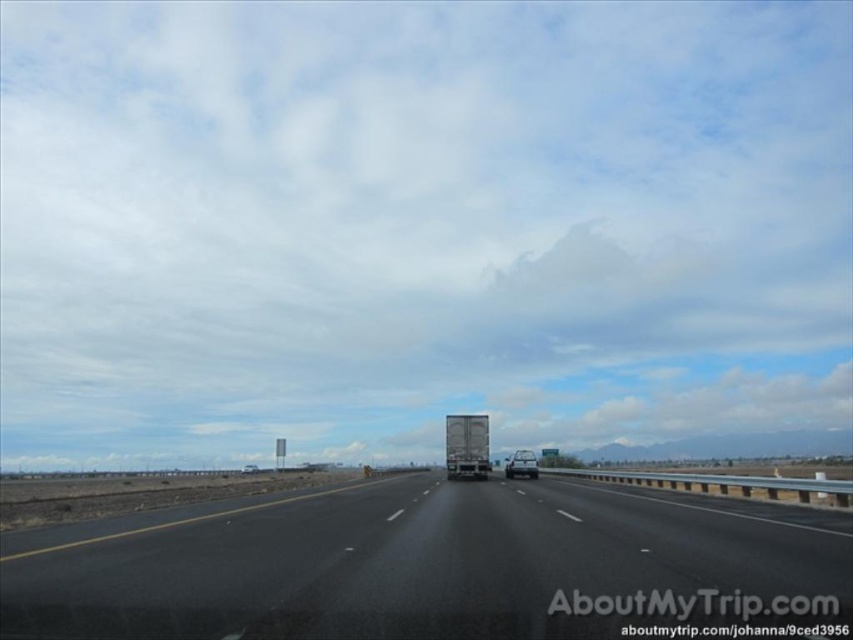
Question: Among these points, which one is farthest from the camera?

Choices:
 (A) (471, 568)
 (B) (529, 289)
 (C) (503, 468)
 (D) (457, 449)

Answer: (B)

Question: Is cloudy sky at upper center wider than black asphalt highway at center?

Choices:
 (A) no
 (B) yes

Answer: (B)

Question: Which object is the closest to the black asphalt highway at center?

Choices:
 (A) silver metallic truck at center
 (B) glossy silver truck at center
 (C) cloudy sky at upper center

Answer: (A)

Question: Can you confirm if black asphalt highway at center is wider than glossy silver truck at center?

Choices:
 (A) no
 (B) yes

Answer: (B)

Question: Which point is farther to the camera?

Choices:
 (A) (679, 88)
 (B) (459, 454)

Answer: (A)

Question: Can you confirm if cloudy sky at upper center is wider than black asphalt highway at center?

Choices:
 (A) no
 (B) yes

Answer: (B)